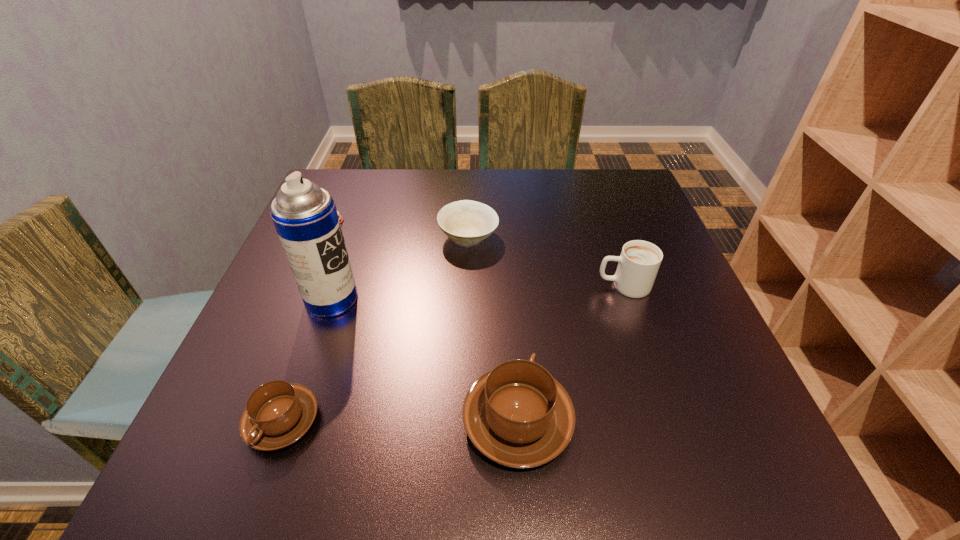
You are a GUI agent. You are given a task and a screenshot of the screen. Output one action in this format:
    pyautogui.click(x=<x>, y=<y>)
    Task: Click on the vacant spot to place a cappuccino on the right
    
    Given the screenshot: What is the action you would take?
    pyautogui.click(x=753, y=421)